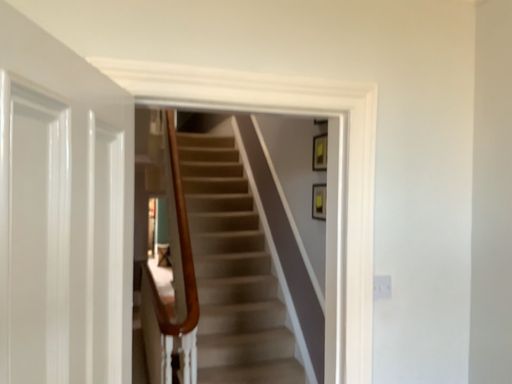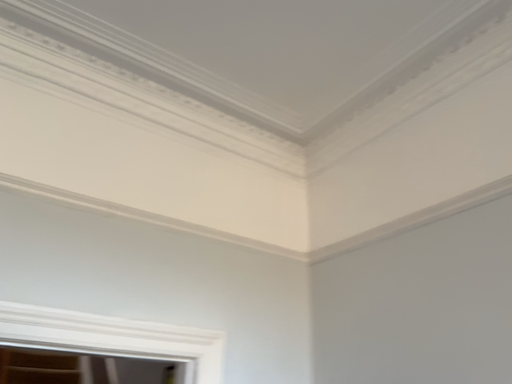
Question: Which way did the camera rotate in the video?

Choices:
 (A) rotated left
 (B) rotated right

Answer: (B)